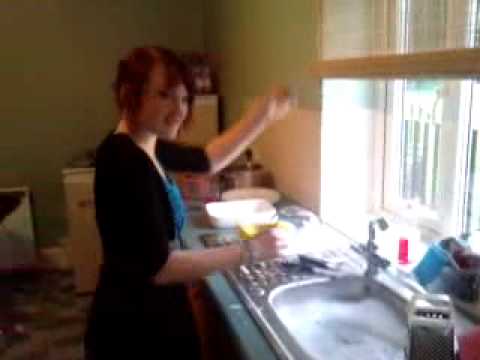
You are a GUI agent. You are given a task and a screenshot of the screen. Output one action in this format:
    pyautogui.click(x=<x>, y=<y>)
    Task: Click on the tap
    
    Given the screenshot: What is the action you would take?
    coord(374,229)